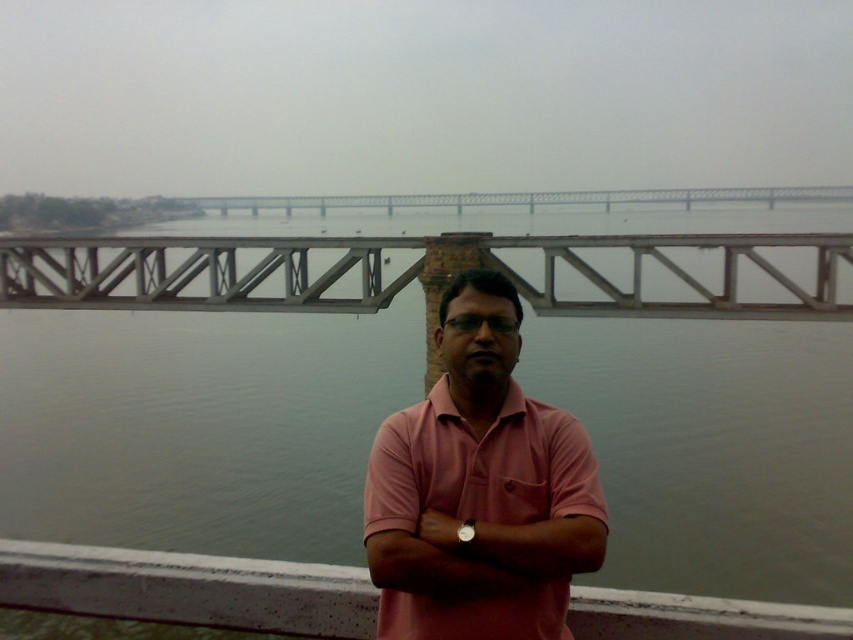
Is pink cotton shirt at center closer to camera compared to metallic gray bridge at upper center?

Yes, it is.

You are a GUI agent. You are given a task and a screenshot of the screen. Output one action in this format:
    pyautogui.click(x=<x>, y=<y>)
    Task: Click on the pink cotton shirt at center
    The height and width of the screenshot is (640, 853).
    Given the screenshot: What is the action you would take?
    pyautogui.click(x=479, y=490)

The image size is (853, 640). Find the location of `pink cotton shirt at center`. pink cotton shirt at center is located at coordinates (479, 490).